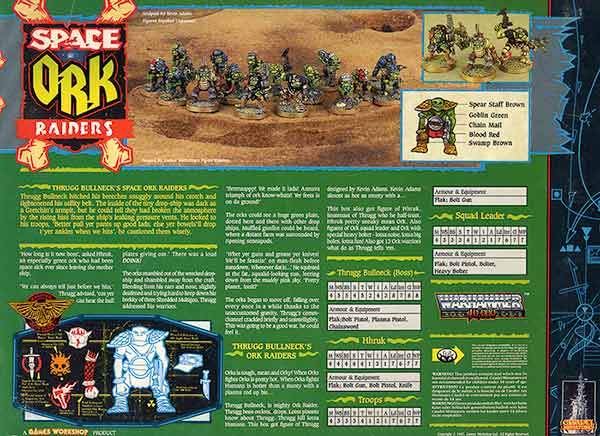
Find the location of a particular element. column 4 is located at coordinates (373, 180).